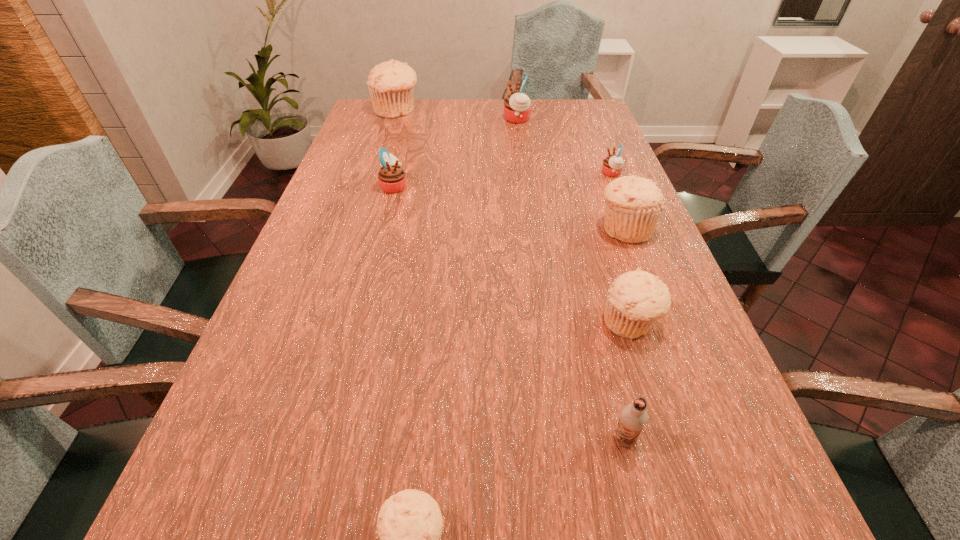
Identify the location of the leftmost beige muffin. (391, 84).

I want to click on the biggest beige muffin, so click(x=391, y=84).

Where is `the farthest pink muffin`? This screenshot has width=960, height=540. the farthest pink muffin is located at coordinates (517, 109).

Image resolution: width=960 pixels, height=540 pixels. Identify the location of the biggest pink muffin. (517, 109).

Where is `the third nearest muffin`? the third nearest muffin is located at coordinates (634, 205).

I want to click on the fourth nearest object, so click(634, 205).

This screenshot has width=960, height=540. I want to click on the leftmost pink muffin, so click(391, 177).

In order to click on chocolate milk in this screenshot , I will do [x=633, y=417].

Where is `the third biggest beige muffin`? This screenshot has width=960, height=540. the third biggest beige muffin is located at coordinates (636, 299).

Where is `the second nearest beige muffin`? the second nearest beige muffin is located at coordinates (636, 299).